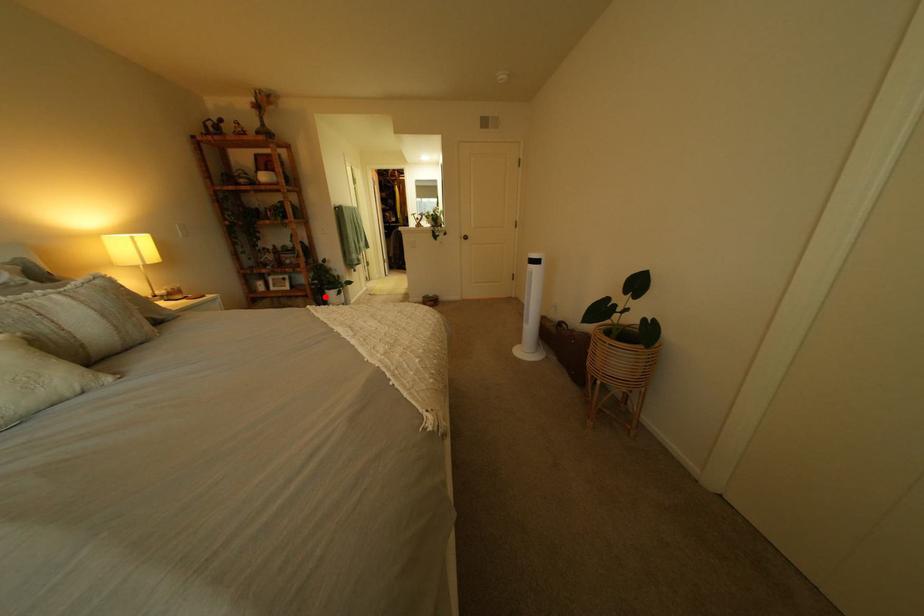
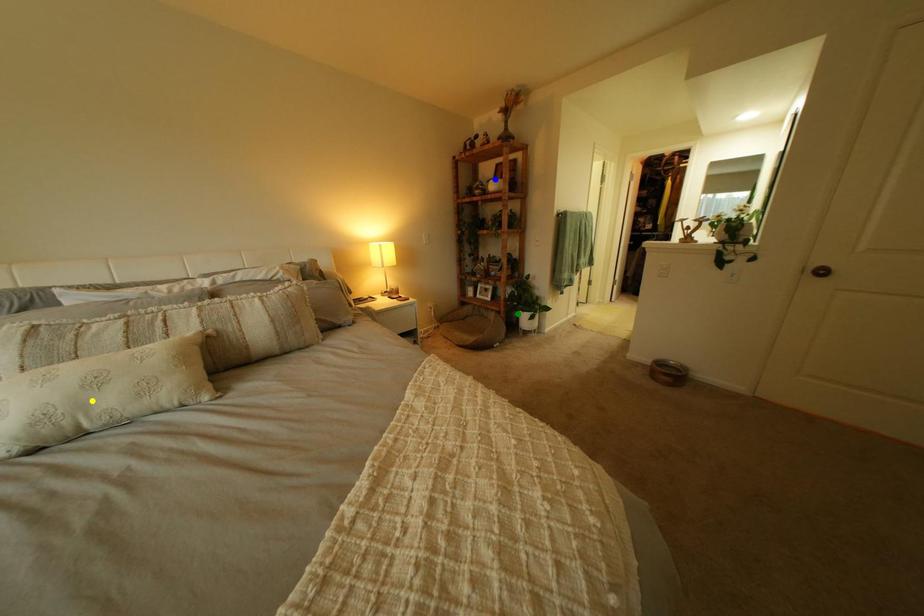
Question: I am providing you with two images of the same scene from different viewpoints. A red point is marked on the first image. You are given multiple points on the second image. Which mark in image 2 goes with the point in image 1?

Choices:
 (A) green point
 (B) blue point
 (C) yellow point

Answer: (A)